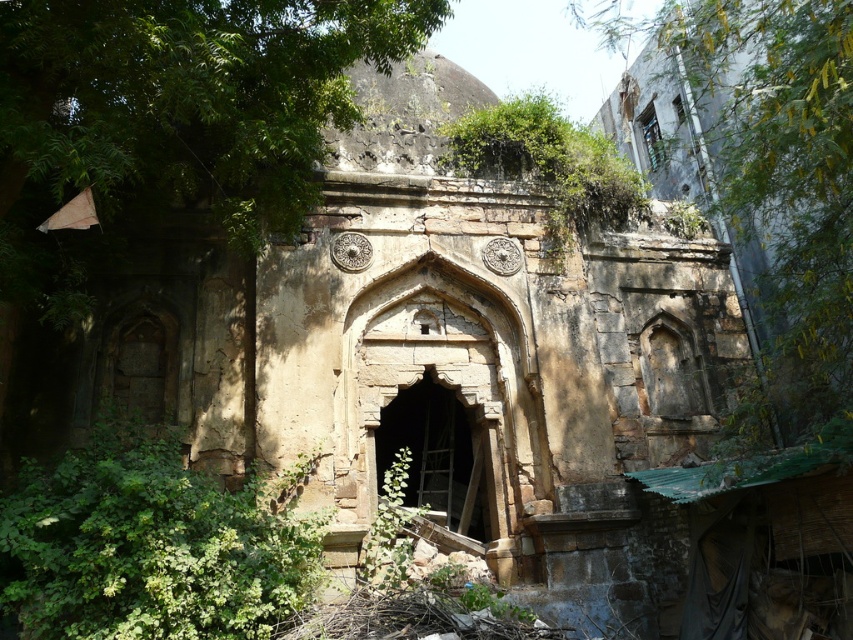
Question: Can you confirm if green leafy tree at upper right is bigger than green leafy plant at lower left?

Choices:
 (A) yes
 (B) no

Answer: (A)

Question: Does green leafy tree at upper right appear on the right side of green leafy plant at lower left?

Choices:
 (A) yes
 (B) no

Answer: (A)

Question: Which of the following is the farthest from the observer?

Choices:
 (A) coord(111,477)
 (B) coord(718,10)

Answer: (B)

Question: Which point is closer to the camera?

Choices:
 (A) (x=82, y=624)
 (B) (x=686, y=33)

Answer: (A)

Question: Is green leafy tree at upper right further to camera compared to green leafy plant at lower left?

Choices:
 (A) yes
 (B) no

Answer: (B)